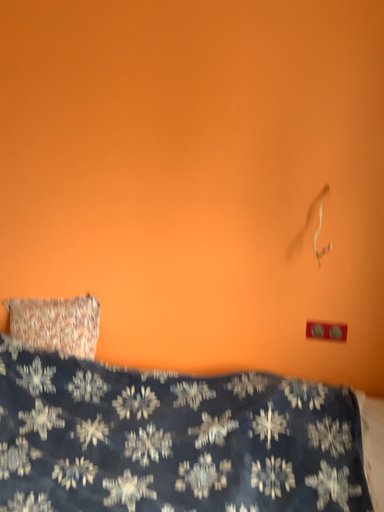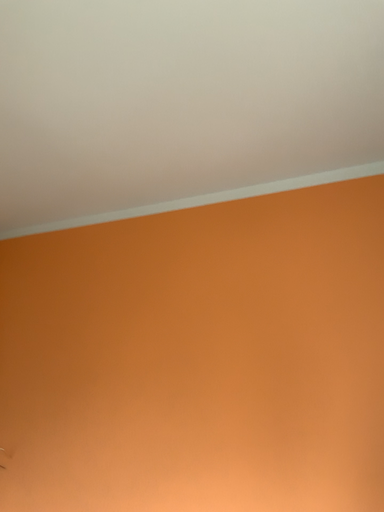
Question: How did the camera likely rotate when shooting the video?

Choices:
 (A) rotated upward
 (B) rotated downward

Answer: (A)